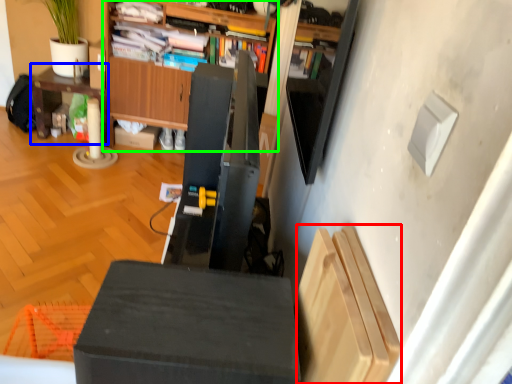
Question: Considering the real-world distances, which object is closest to shelf (highlighted by a red box)? table (highlighted by a blue box) or cabinetry (highlighted by a green box).

Choices:
 (A) table
 (B) cabinetry

Answer: (B)